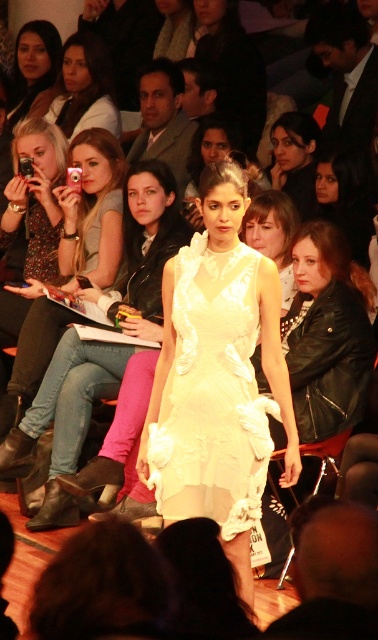
Question: Can you confirm if matte black leather jacket at upper center is wider than matte black dress at upper left?

Choices:
 (A) yes
 (B) no

Answer: (A)

Question: Which of these objects is positioned closest to the matte gray suit at upper center?

Choices:
 (A) white satin dress at center
 (B) matte white dress at center
 (C) denim jeans at center

Answer: (C)

Question: Estimate the real-world distances between objects in this image. Which object is farther from the white satin dress at center?

Choices:
 (A) matte black leather jacket at upper right
 (B) matte black leather jacket at upper center
 (C) matte black hair at upper center

Answer: (B)

Question: Can you confirm if matte black leather jacket at upper right is bigger than matte black dress at upper left?

Choices:
 (A) yes
 (B) no

Answer: (B)

Question: Does denim jeans at center have a larger size compared to matte black camera at left?

Choices:
 (A) no
 (B) yes

Answer: (A)

Question: Which point is farther to the camera?

Choices:
 (A) (69, 49)
 (B) (229, 67)
 (C) (275, 180)
 (D) (24, 67)

Answer: (D)